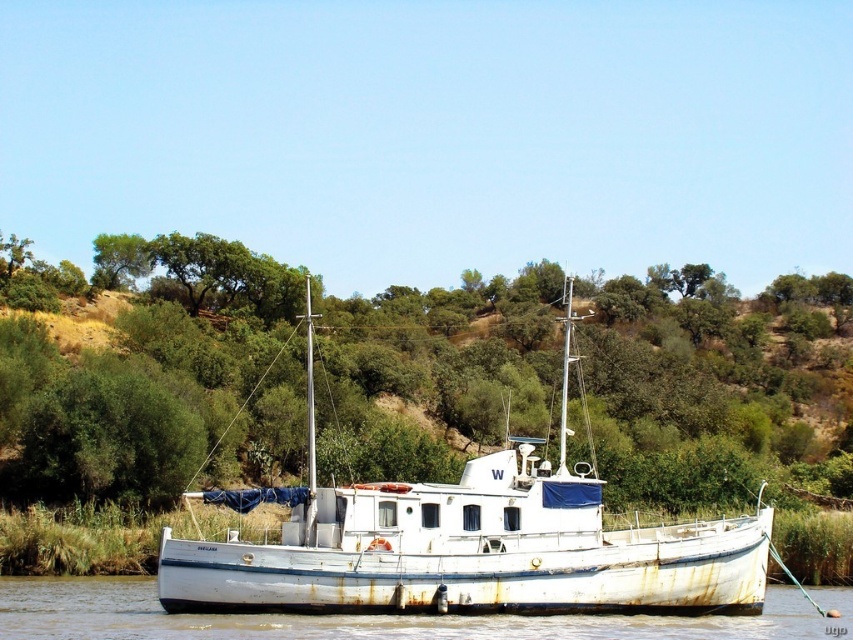
Question: Which object appears closest to the camera in this image?

Choices:
 (A) green leafy tree at center
 (B) white weathered wood boat at center

Answer: (B)

Question: Is the position of white weathered wood boat at center more distant than that of white matte boat at center?

Choices:
 (A) no
 (B) yes

Answer: (B)

Question: Which of the following is the closest to the observer?

Choices:
 (A) (106, 605)
 (B) (165, 552)
 (C) (614, 472)

Answer: (B)

Question: In this image, where is white weathered wood boat at center located relative to white matte boat at center?

Choices:
 (A) left
 (B) right

Answer: (B)

Question: Which of the following is the farthest from the observer?

Choices:
 (A) (704, 467)
 (B) (230, 625)

Answer: (A)

Question: Can you confirm if white weathered wood boat at center is wider than white matte boat at center?

Choices:
 (A) no
 (B) yes

Answer: (A)